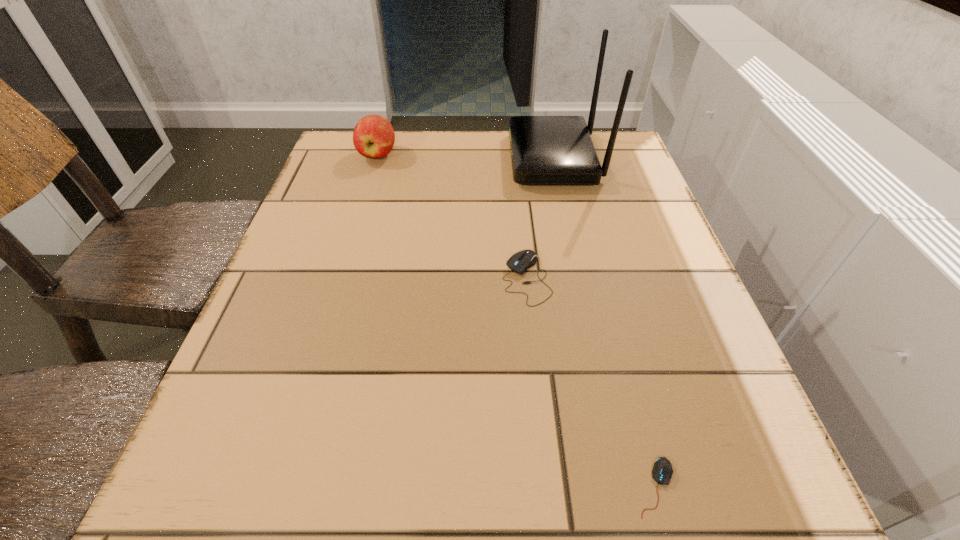
This screenshot has height=540, width=960. What are the coordinates of `free space that satisfies the following two spatial constraints: 1. on the front-facing side of the tallest object; 2. on the front side of the third farthest object` in the screenshot? It's located at (580, 279).

You are a GUI agent. You are given a task and a screenshot of the screen. Output one action in this format:
    pyautogui.click(x=<x>, y=<y>)
    Task: Click on the vacant area that satisfies the following two spatial constraints: 1. on the front side of the taller mouse; 2. on the left side of the right mouse
    The width and height of the screenshot is (960, 540).
    Given the screenshot: What is the action you would take?
    pyautogui.click(x=547, y=487)

Where is `vacant position in the image that satisfies the following two spatial constraints: 1. on the back side of the nearest object; 2. on the front-facing side of the router`? This screenshot has width=960, height=540. vacant position in the image that satisfies the following two spatial constraints: 1. on the back side of the nearest object; 2. on the front-facing side of the router is located at coordinates (569, 159).

I want to click on free point that satisfies the following two spatial constraints: 1. on the front side of the right mouse; 2. on the right side of the second tallest object, so click(276, 487).

The image size is (960, 540). What are the coordinates of `free point that satisfies the following two spatial constraints: 1. on the front-facing side of the nearest object; 2. on the right side of the router` in the screenshot? It's located at (625, 487).